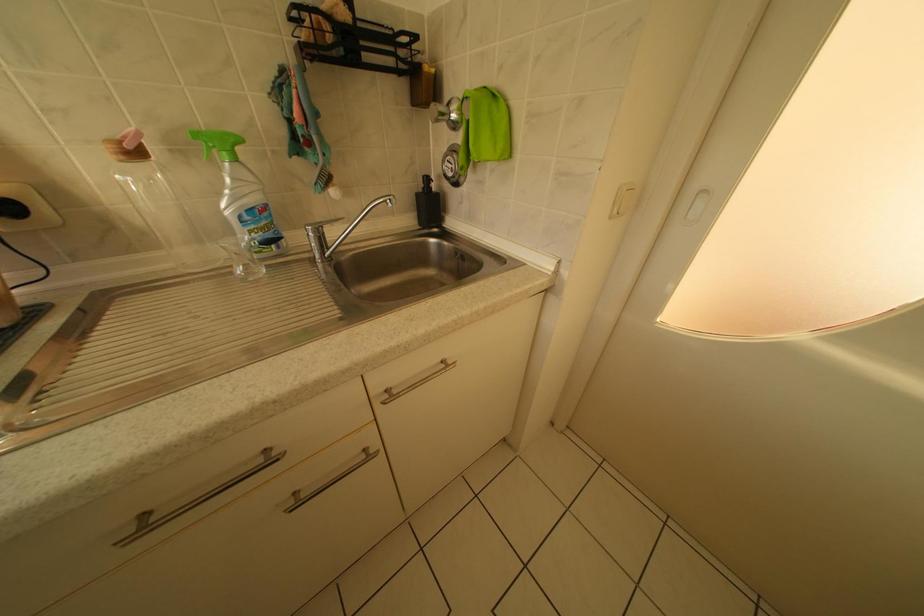
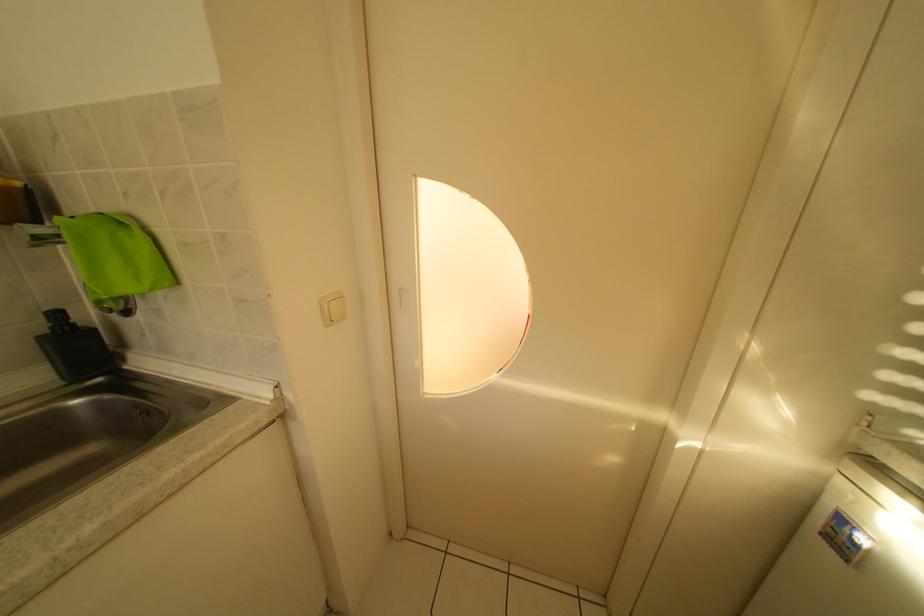
Question: How did the camera likely rotate?

Choices:
 (A) Left
 (B) Right
 (C) Up
 (D) Down

Answer: (B)